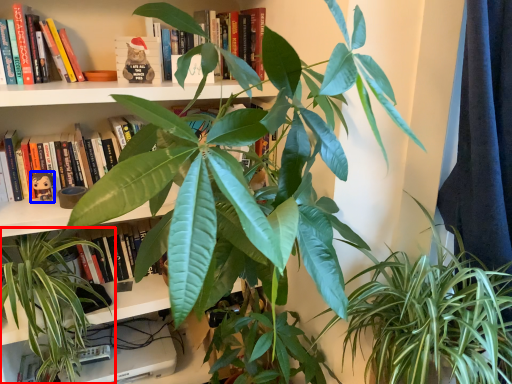
Question: Which object appears closest to the camera in this image, houseplant (highlighted by a red box) or toy (highlighted by a blue box)?

Choices:
 (A) houseplant
 (B) toy

Answer: (A)